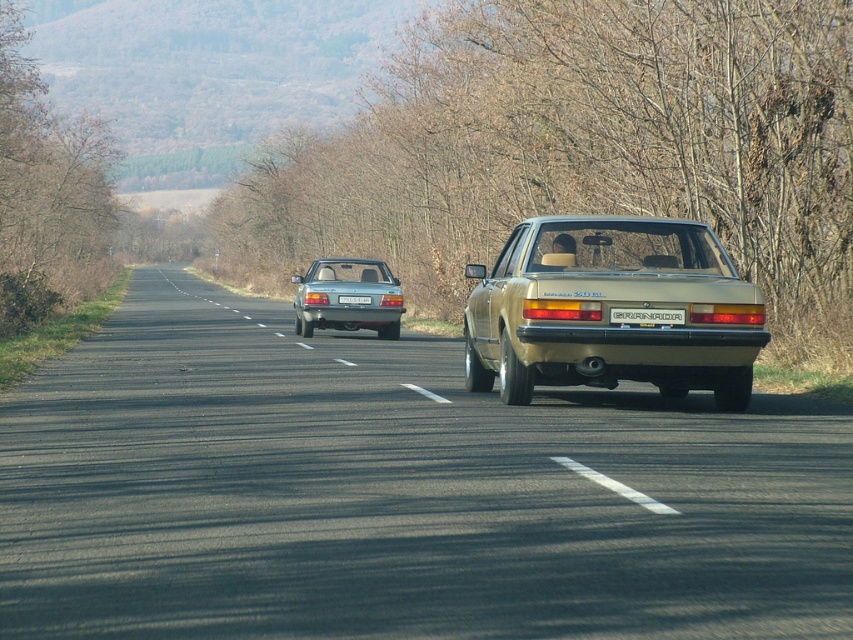
Looking at this image, you are a pedestrian standing at the edge of the road. You see a gold metallic sedan at center and a white plastic license plate at center. Which object is larger in size?

The gold metallic sedan at center is bigger than the white plastic license plate at center.

You are a driver approaching the intersection ahead. There is a satin silver sedan at center. Based on its position, can you determine if it is on the left or right lane of the road?

The satin silver sedan at center is positioned at point [347,294], which is closer to the right lane of the road.